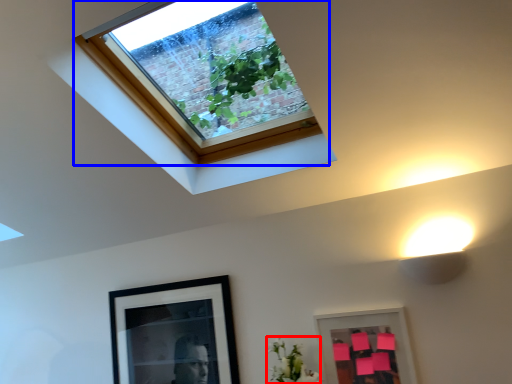
Question: Among these objects, which one is nearest to the camera, flower (highlighted by a red box) or window (highlighted by a blue box)?

Choices:
 (A) flower
 (B) window

Answer: (B)